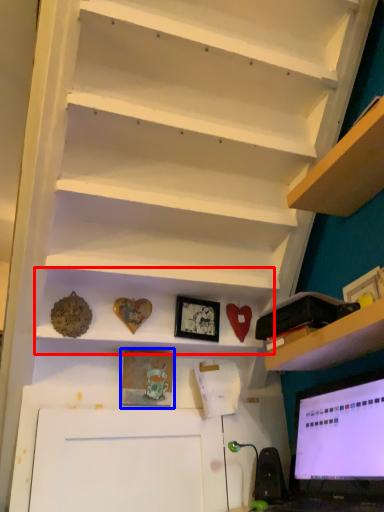
Question: Which object appears farthest to the camera in this image, cabinet (highlighted by a red box) or picture frame (highlighted by a blue box)?

Choices:
 (A) cabinet
 (B) picture frame

Answer: (B)